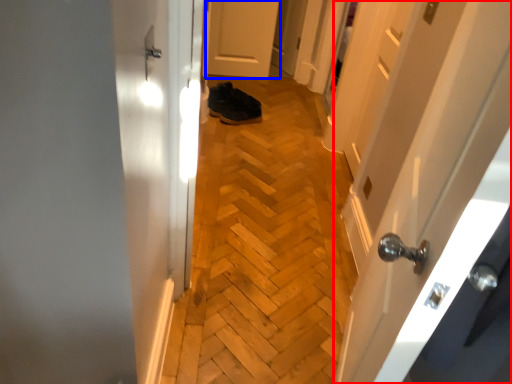
Question: Among these objects, which one is nearest to the camera, door (highlighted by a red box) or door (highlighted by a blue box)?

Choices:
 (A) door
 (B) door

Answer: (A)